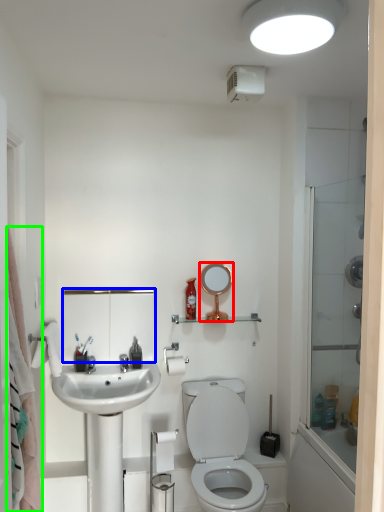
Question: Based on their relative distances, which object is farther from mirror (highlighted by a red box)? Choose from medicine cabinet (highlighted by a blue box) and shower curtain (highlighted by a green box).

Choices:
 (A) medicine cabinet
 (B) shower curtain

Answer: (B)